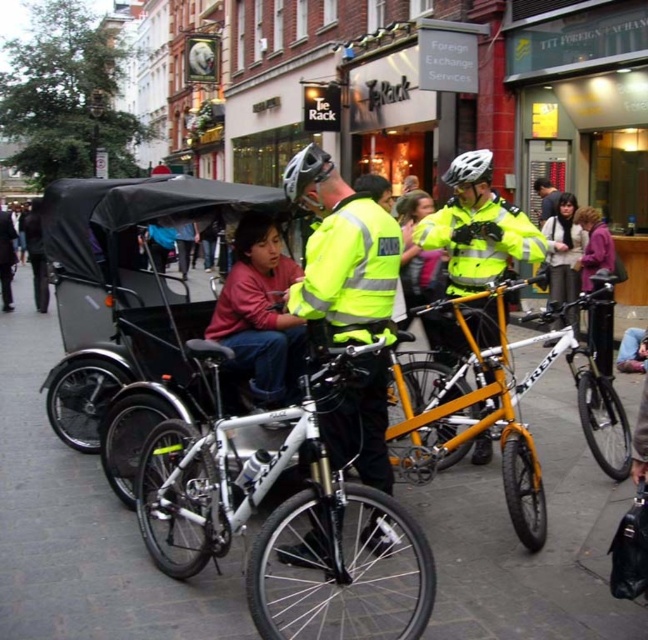
You are a delivery person who needs to pass through a narrow alleyway that is only 1.2 meters wide. You have to navigate around the black fabric rickshaw at center and the dark blue jeans at left. Which object do you need to move to ensure you can pass through the alleyway?

The black fabric rickshaw at center might be wider than dark blue jeans at left, so you should move the black fabric rickshaw at center to ensure you can pass through the alleyway.

You are a delivery person who needs to load a package onto the white matte trek mountain bike at center and the black fabric rickshaw at center. Which vehicle will require a lower loading height due to its shorter stature?

The white matte trek mountain bike at center is shorter than the black fabric rickshaw at center, so it will require a lower loading height.

You are a delivery person who needs to load a package onto the black fabric rickshaw at center. The package is too heavy to lift over your head. Can you place it directly in front of the dark blue jeans at left without moving the jeans?

The black fabric rickshaw at center is located below dark blue jeans at left, so yes, you can place the package directly in front of the dark blue jeans at left since the rickshaw is positioned lower and won not block the area in front of the jeans.